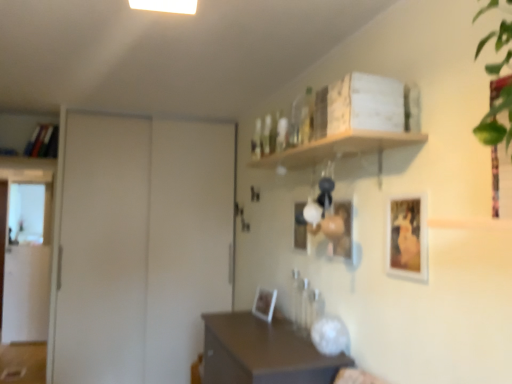
In order to click on free spot to the right of translucent glass bottle at upper center in this screenshot , I will do `click(335, 146)`.